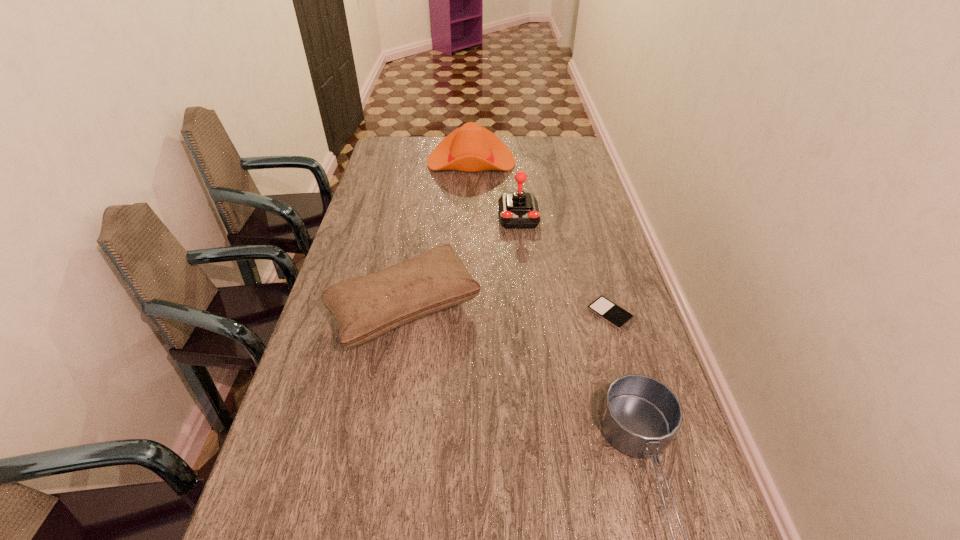
Where is `joystick`? joystick is located at coordinates (517, 210).

The width and height of the screenshot is (960, 540). In order to click on cowboy hat in this screenshot , I will do `click(470, 148)`.

The width and height of the screenshot is (960, 540). Identify the location of cushion. (366, 307).

Where is `the shortest object`? the shortest object is located at coordinates (604, 308).

The height and width of the screenshot is (540, 960). Find the location of `vacant space situated 0.220m on the base of the joystick`. vacant space situated 0.220m on the base of the joystick is located at coordinates (525, 278).

Locate an element on the screen. This screenshot has width=960, height=540. vacant space located on the front of the cowboy hat is located at coordinates (468, 241).

I want to click on free space located 0.190m on the right of the cushion, so click(x=547, y=307).

Where is `vacant region located 0.080m on the front of the shortest object`? vacant region located 0.080m on the front of the shortest object is located at coordinates (621, 354).

Identify the location of object that is at the far edge. Image resolution: width=960 pixels, height=540 pixels. (470, 148).

Where is `object present at the left edge`? The height and width of the screenshot is (540, 960). object present at the left edge is located at coordinates (366, 307).